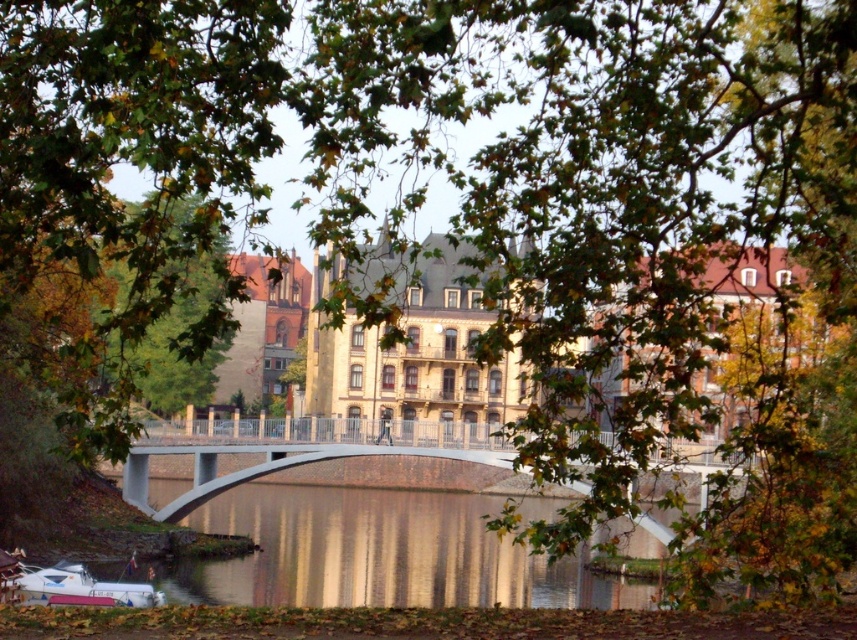
You are a photographer planning to capture the entire scene in one shot. Given that the glossy reflective water at center and the concrete bridge at center are both in your frame, which one appears shorter in the photo?

The glossy reflective water at center appears shorter because it has a lesser height compared to the concrete bridge at center.

You are standing at the riverside and want to cross to the other side. The concrete bridge at center is the only path available. If you walk towards it at a speed of 1.5 meters per second, how many seconds will it take you to reach the bridge?

The concrete bridge at center is 95.90 meters away from the viewer. At a walking speed of 1.5 meters per second, it will take approximately 63.93 seconds to reach the bridge. This is calculated by dividing the distance by the speed.